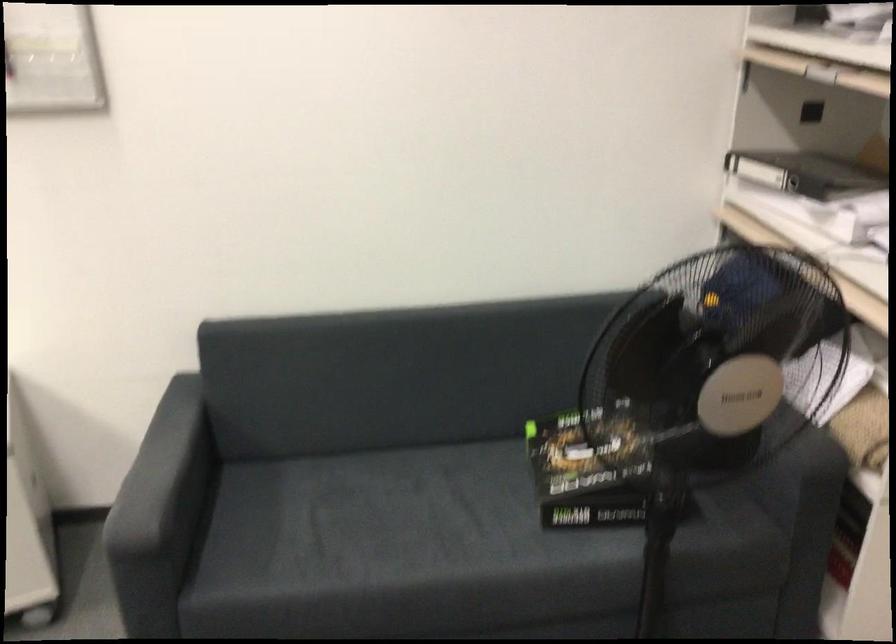
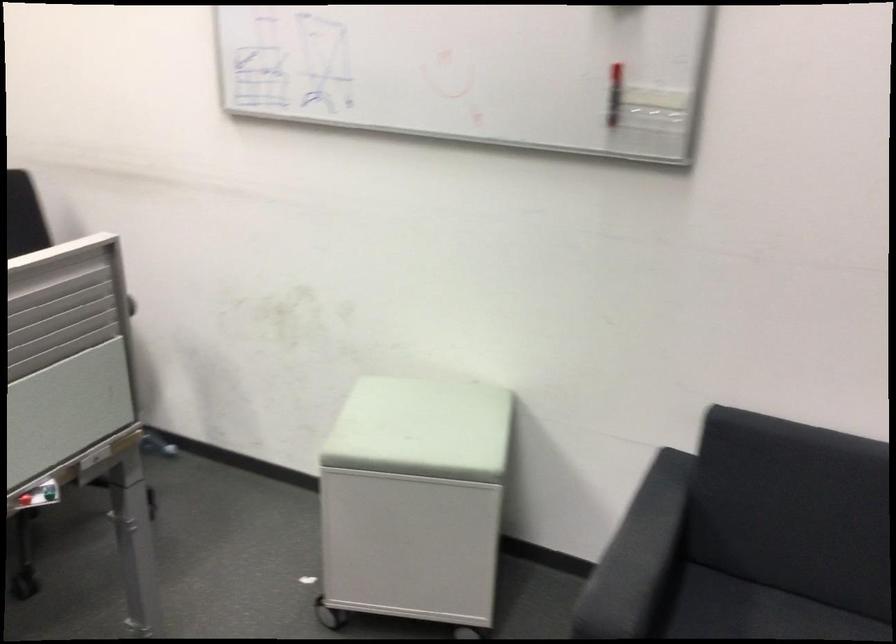
Question: The camera is either moving clockwise (left) or counter-clockwise (right) around the object. The first image is from the beginning of the video and the second image is from the end. Is the camera moving left or right when shooting the video?

Choices:
 (A) Left
 (B) Right

Answer: (B)